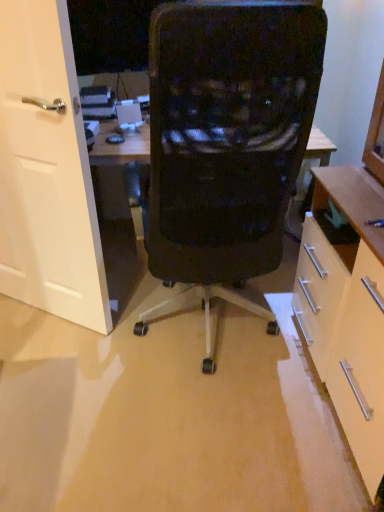
Question: Does matte white cabinet at right have a greater height compared to white matte door at left?

Choices:
 (A) no
 (B) yes

Answer: (A)

Question: Considering the relative positions of matte white cabinet at right and white matte door at left in the image provided, is matte white cabinet at right to the left of white matte door at left from the viewer's perspective?

Choices:
 (A) yes
 (B) no

Answer: (B)

Question: From a real-world perspective, is matte white cabinet at right physically below white matte door at left?

Choices:
 (A) yes
 (B) no

Answer: (B)

Question: Is matte white cabinet at right not inside white matte door at left?

Choices:
 (A) no
 (B) yes

Answer: (B)

Question: Is matte white cabinet at right thinner than white matte door at left?

Choices:
 (A) no
 (B) yes

Answer: (A)

Question: Considering their positions, is matte white cabinet at right located in front of or behind black mesh chair at center?

Choices:
 (A) front
 (B) behind

Answer: (A)

Question: Is point (370, 435) positioned closer to the camera than point (256, 159)?

Choices:
 (A) closer
 (B) farther

Answer: (A)

Question: Considering the positions of matte white cabinet at right and black mesh chair at center in the image, is matte white cabinet at right wider or thinner than black mesh chair at center?

Choices:
 (A) wide
 (B) thin

Answer: (B)

Question: From the image's perspective, is matte white cabinet at right located above or below black mesh chair at center?

Choices:
 (A) below
 (B) above

Answer: (A)

Question: Considering the positions of point (183, 124) and point (354, 349), is point (183, 124) closer or farther from the camera than point (354, 349)?

Choices:
 (A) closer
 (B) farther

Answer: (A)

Question: Is black mesh chair at center inside or outside of matte white cabinet at right?

Choices:
 (A) outside
 (B) inside

Answer: (A)

Question: In the image, is black mesh chair at center on the left side or the right side of matte white cabinet at right?

Choices:
 (A) left
 (B) right

Answer: (A)

Question: From the image's perspective, is black mesh chair at center positioned above or below matte white cabinet at right?

Choices:
 (A) above
 (B) below

Answer: (A)

Question: In terms of size, does matte white cabinet at right appear bigger or smaller than white matte door at left?

Choices:
 (A) small
 (B) big

Answer: (B)

Question: In the image, is matte white cabinet at right positioned in front of or behind white matte door at left?

Choices:
 (A) front
 (B) behind

Answer: (A)